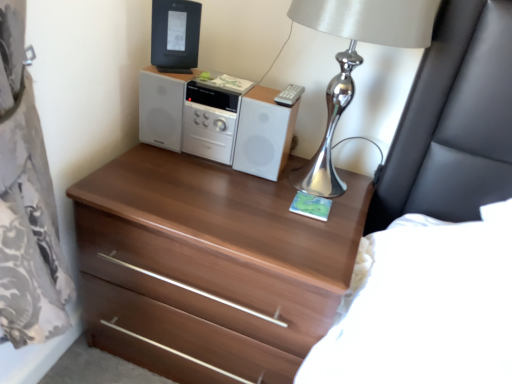
Question: Are silver metallic table lamp at upper right and black plastic desktop computer at upper center making contact?

Choices:
 (A) no
 (B) yes

Answer: (A)

Question: Is silver metallic table lamp at upper right positioned in front of black plastic desktop computer at upper center?

Choices:
 (A) no
 (B) yes

Answer: (B)

Question: Does silver metallic table lamp at upper right have a larger size compared to black plastic desktop computer at upper center?

Choices:
 (A) yes
 (B) no

Answer: (A)

Question: Does silver metallic table lamp at upper right turn towards black plastic desktop computer at upper center?

Choices:
 (A) yes
 (B) no

Answer: (B)

Question: From the image's perspective, is silver metallic table lamp at upper right located beneath black plastic desktop computer at upper center?

Choices:
 (A) yes
 (B) no

Answer: (A)

Question: Is point (346, 21) closer or farther from the camera than point (210, 337)?

Choices:
 (A) closer
 (B) farther

Answer: (A)

Question: From the image's perspective, is silver metallic table lamp at upper right located above or below walnut wood chest of drawers at center?

Choices:
 (A) above
 (B) below

Answer: (A)

Question: From a real-world perspective, is silver metallic table lamp at upper right physically located above or below walnut wood chest of drawers at center?

Choices:
 (A) below
 (B) above

Answer: (B)

Question: Is silver metallic table lamp at upper right in front of or behind walnut wood chest of drawers at center in the image?

Choices:
 (A) behind
 (B) front

Answer: (B)

Question: From the image's perspective, is white glossy stereo at center located above or below walnut wood chest of drawers at center?

Choices:
 (A) below
 (B) above

Answer: (B)

Question: Looking at the image, does white glossy stereo at center seem bigger or smaller compared to walnut wood chest of drawers at center?

Choices:
 (A) small
 (B) big

Answer: (A)

Question: In terms of width, does white glossy stereo at center look wider or thinner when compared to walnut wood chest of drawers at center?

Choices:
 (A) wide
 (B) thin

Answer: (B)

Question: Do you think white glossy stereo at center is within walnut wood chest of drawers at center, or outside of it?

Choices:
 (A) inside
 (B) outside

Answer: (B)

Question: From a real-world perspective, is black plastic desktop computer at upper center above or below white glossy stereo at center?

Choices:
 (A) below
 (B) above

Answer: (B)

Question: From the image's perspective, relative to white glossy stereo at center, is black plastic desktop computer at upper center above or below?

Choices:
 (A) above
 (B) below

Answer: (A)